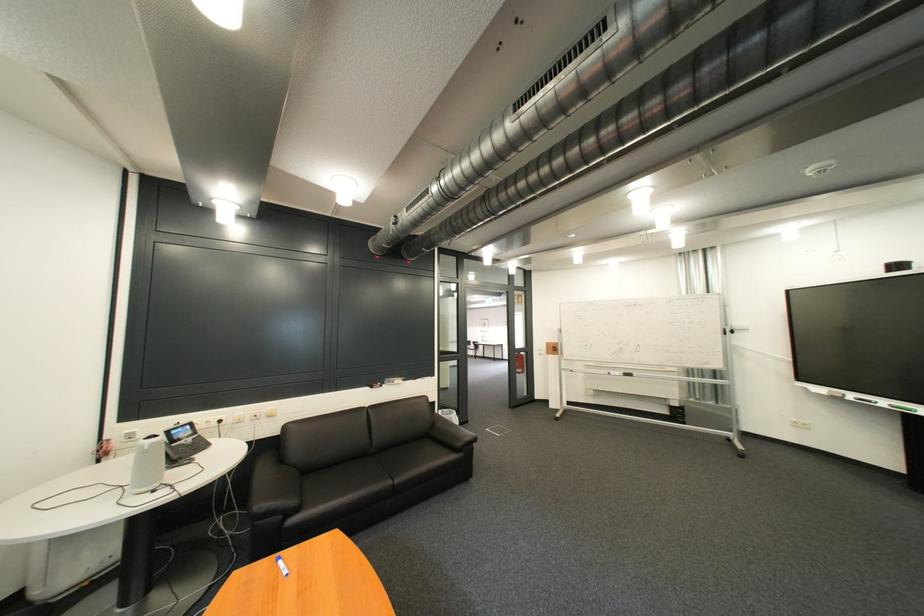
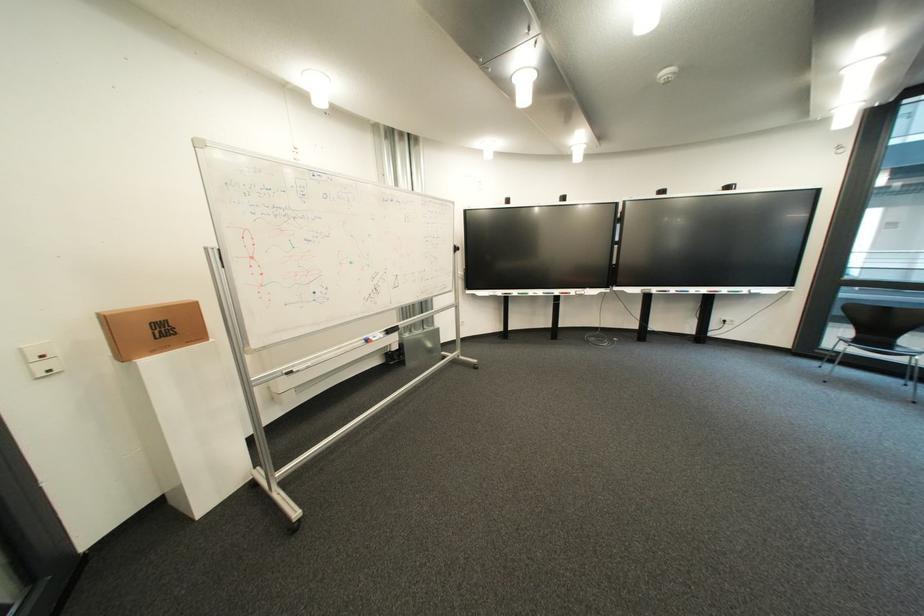
Locate, in the second image, the point that corresponds to (x=562, y=355) in the first image.

(139, 358)